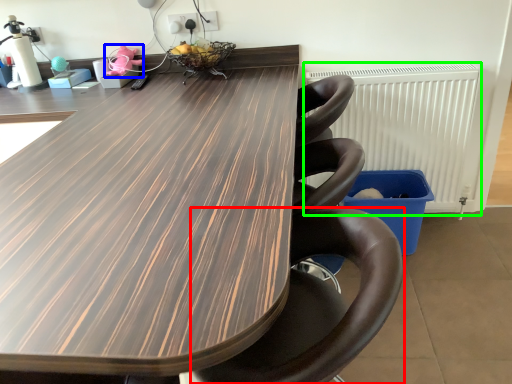
Question: Which is farther away from chair (highlighted by a red box)? toy (highlighted by a blue box) or radiator (highlighted by a green box)?

Choices:
 (A) toy
 (B) radiator

Answer: (A)